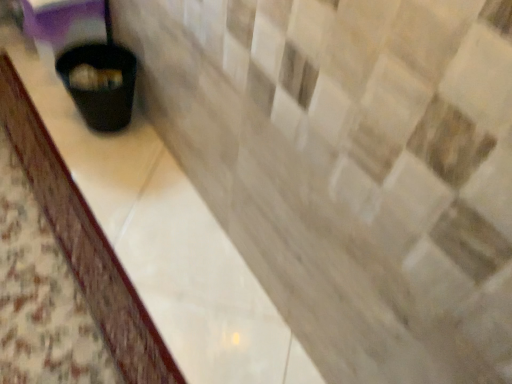
Question: Is black plastic waste container at lower left to the left of black plastic trash can at lower left from the viewer's perspective?

Choices:
 (A) no
 (B) yes

Answer: (A)

Question: Is black plastic waste container at lower left thinner than black plastic trash can at lower left?

Choices:
 (A) no
 (B) yes

Answer: (B)

Question: Is black plastic waste container at lower left positioned in front of black plastic trash can at lower left?

Choices:
 (A) no
 (B) yes

Answer: (A)

Question: From the image's perspective, is black plastic waste container at lower left beneath black plastic trash can at lower left?

Choices:
 (A) no
 (B) yes

Answer: (A)

Question: Does black plastic waste container at lower left have a lesser height compared to black plastic trash can at lower left?

Choices:
 (A) yes
 (B) no

Answer: (B)

Question: From a real-world perspective, is black plastic waste container at lower left beneath black plastic trash can at lower left?

Choices:
 (A) yes
 (B) no

Answer: (B)

Question: From the image's perspective, is black plastic trash can at lower left located beneath black plastic waste container at lower left?

Choices:
 (A) no
 (B) yes

Answer: (B)

Question: Does black plastic trash can at lower left have a larger size compared to black plastic waste container at lower left?

Choices:
 (A) yes
 (B) no

Answer: (B)

Question: From the image's perspective, is black plastic trash can at lower left on top of black plastic waste container at lower left?

Choices:
 (A) no
 (B) yes

Answer: (A)

Question: Can you confirm if black plastic trash can at lower left is positioned to the right of black plastic waste container at lower left?

Choices:
 (A) yes
 (B) no

Answer: (B)

Question: Does black plastic trash can at lower left have a lesser width compared to black plastic waste container at lower left?

Choices:
 (A) no
 (B) yes

Answer: (A)

Question: Can you confirm if black plastic trash can at lower left is taller than black plastic waste container at lower left?

Choices:
 (A) no
 (B) yes

Answer: (A)

Question: From the image's perspective, is black plastic trash can at lower left positioned above or below black plastic waste container at lower left?

Choices:
 (A) above
 (B) below

Answer: (B)